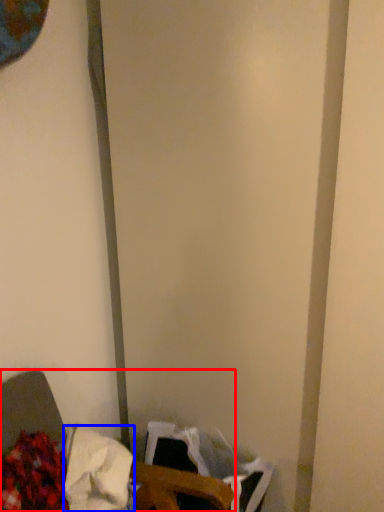
Question: Which point is further to the camera, furniture (highlighted by a red box) or waste (highlighted by a blue box)?

Choices:
 (A) furniture
 (B) waste

Answer: (B)